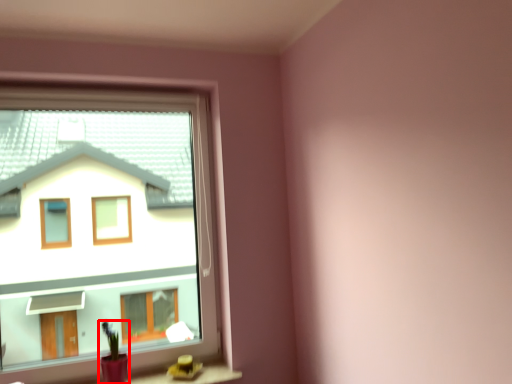
Question: Observing the image, what is the correct spatial positioning of houseplant (annotated by the red box) in reference to window?

Choices:
 (A) right
 (B) left

Answer: (A)